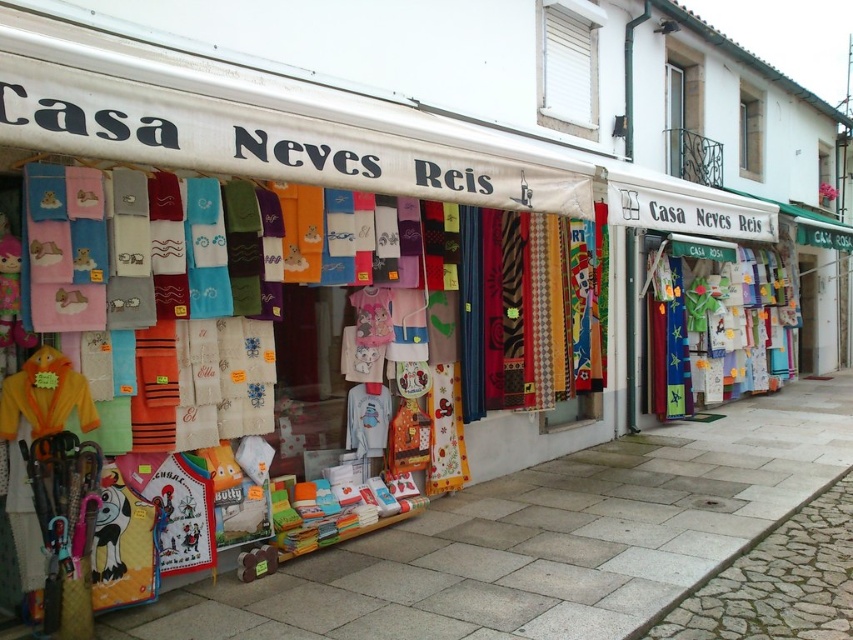
Question: Can you confirm if smooth stone pavement at lower center is positioned below transparent glass window at upper center?

Choices:
 (A) yes
 (B) no

Answer: (A)

Question: Is smooth stone pavement at lower center positioned before transparent glass window at upper center?

Choices:
 (A) yes
 (B) no

Answer: (A)

Question: Which point is closer to the camera?

Choices:
 (A) transparent glass window at upper center
 (B) smooth stone pavement at lower center

Answer: (B)

Question: Which of the following is the closest to the observer?

Choices:
 (A) (193, 628)
 (B) (746, 86)

Answer: (A)

Question: Does smooth stone pavement at lower center appear under transparent glass window at upper center?

Choices:
 (A) no
 (B) yes

Answer: (B)

Question: Which point is closer to the camera?

Choices:
 (A) transparent glass window at upper center
 (B) smooth stone pavement at lower center

Answer: (B)